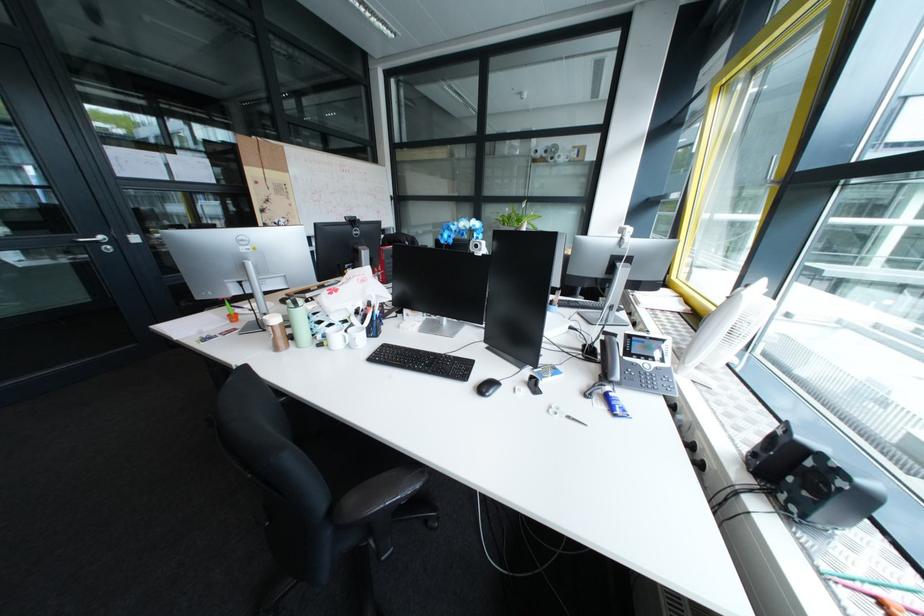
Find where to grasp the black webcam. Please return your answer as a coordinate pair (x, y).

(812, 480)